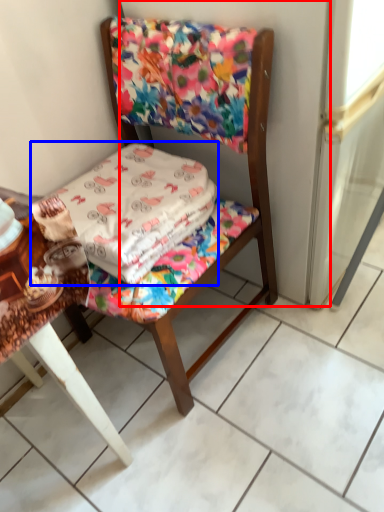
Question: Which point is further to the camera, screen door (highlighted by a red box) or blanket (highlighted by a blue box)?

Choices:
 (A) screen door
 (B) blanket

Answer: (B)